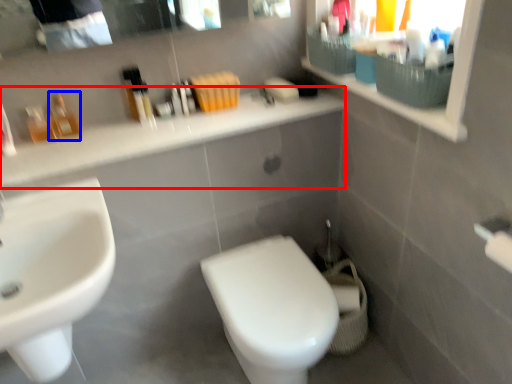
Question: Which of the following is the closest to the observer, counter top (highlighted by a red box) or toiletry (highlighted by a blue box)?

Choices:
 (A) counter top
 (B) toiletry

Answer: (A)